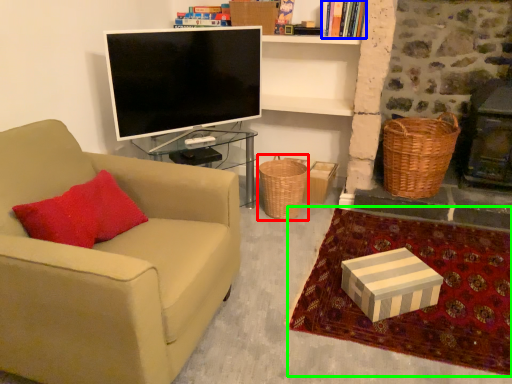
Question: Estimate the real-world distances between objects in this image. Which object is farther from basket (highlighted by a red box), book (highlighted by a blue box) or blanket (highlighted by a green box)?

Choices:
 (A) book
 (B) blanket

Answer: (A)